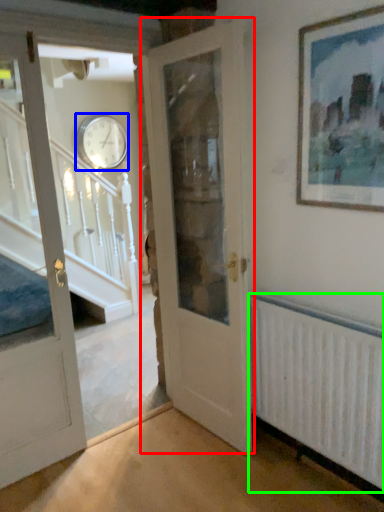
Question: Based on their relative distances, which object is nearer to door (highlighted by a red box)? Choose from clock (highlighted by a blue box) and radiator (highlighted by a green box).

Choices:
 (A) clock
 (B) radiator

Answer: (B)